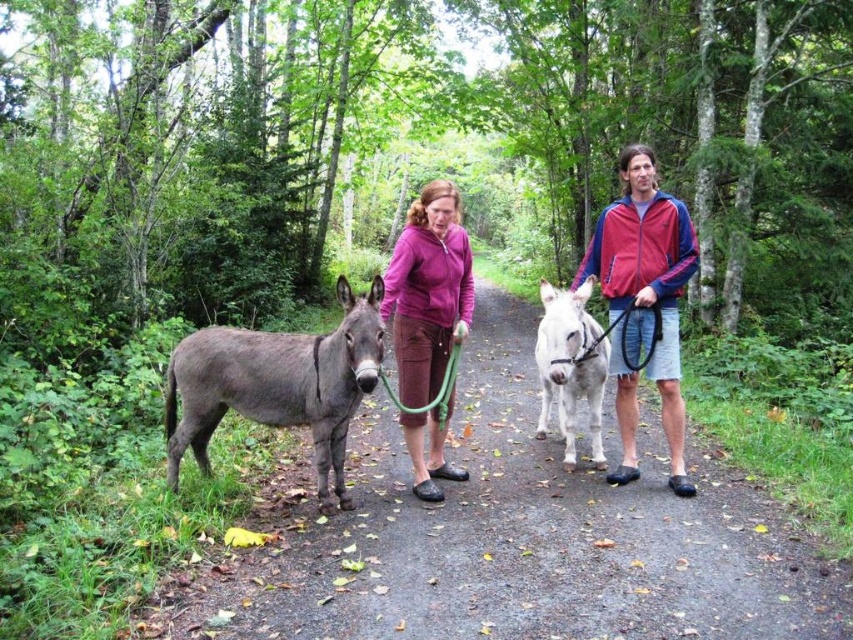
Which is above, gray matte mule at left or matte purple jacket at center?

matte purple jacket at center is higher up.

Is gray matte mule at left closer to the viewer compared to matte purple jacket at center?

Yes.

Image resolution: width=853 pixels, height=640 pixels. Identify the location of gray matte mule at left. (277, 385).

Between smooth dirt path at center and green rubber hose at center, which one appears on the left side from the viewer's perspective?

Positioned to the left is green rubber hose at center.

Who is more distant from viewer, (432, 634) or (451, 376)?

The point (451, 376) is more distant.

You are a GUI agent. You are given a task and a screenshot of the screen. Output one action in this format:
    pyautogui.click(x=<x>, y=<y>)
    Task: Click on the smooth dirt path at center
    
    Given the screenshot: What is the action you would take?
    pyautogui.click(x=512, y=540)

Does smooth dirt path at center have a greater width compared to red/purple jacket at center?

Correct, the width of smooth dirt path at center exceeds that of red/purple jacket at center.

Can you confirm if smooth dirt path at center is positioned to the left of red/purple jacket at center?

Indeed, smooth dirt path at center is positioned on the left side of red/purple jacket at center.

Describe the element at coordinates (512, 540) in the screenshot. This screenshot has height=640, width=853. I see `smooth dirt path at center` at that location.

Where is `smooth dirt path at center`? This screenshot has height=640, width=853. smooth dirt path at center is located at coordinates (512, 540).